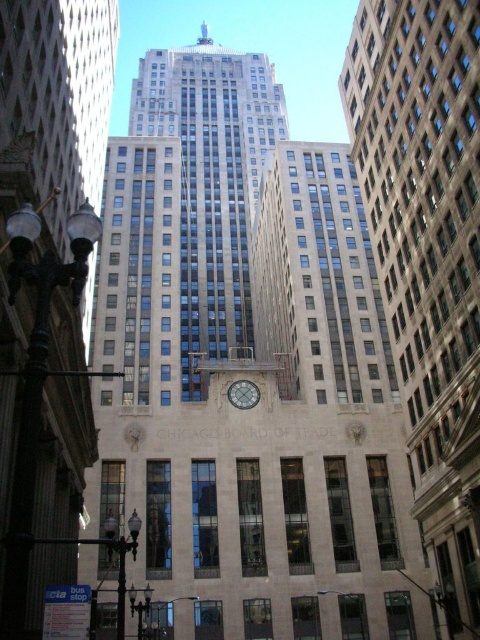
Question: Can you confirm if beige stone clock tower at center is positioned to the right of stone clock tower at center?

Choices:
 (A) no
 (B) yes

Answer: (B)

Question: Based on their relative distances, which object is nearer to the stone clock tower at center?

Choices:
 (A) beige stone clock tower at center
 (B) polished stone clock tower at center
 (C) silver metallic clock at center

Answer: (C)

Question: Among these objects, which one is farthest from the camera?

Choices:
 (A) stone clock tower at center
 (B) beige stone clock tower at center
 (C) silver metallic clock at center

Answer: (C)

Question: Can you confirm if polished stone clock tower at center is thinner than silver metallic clock at center?

Choices:
 (A) no
 (B) yes

Answer: (A)

Question: Does polished stone clock tower at center have a smaller size compared to silver metallic clock at center?

Choices:
 (A) yes
 (B) no

Answer: (B)

Question: Which object is farther from the camera taking this photo?

Choices:
 (A) silver metallic clock at center
 (B) polished stone clock tower at center
 (C) beige stone clock tower at center
 (D) stone clock tower at center

Answer: (A)